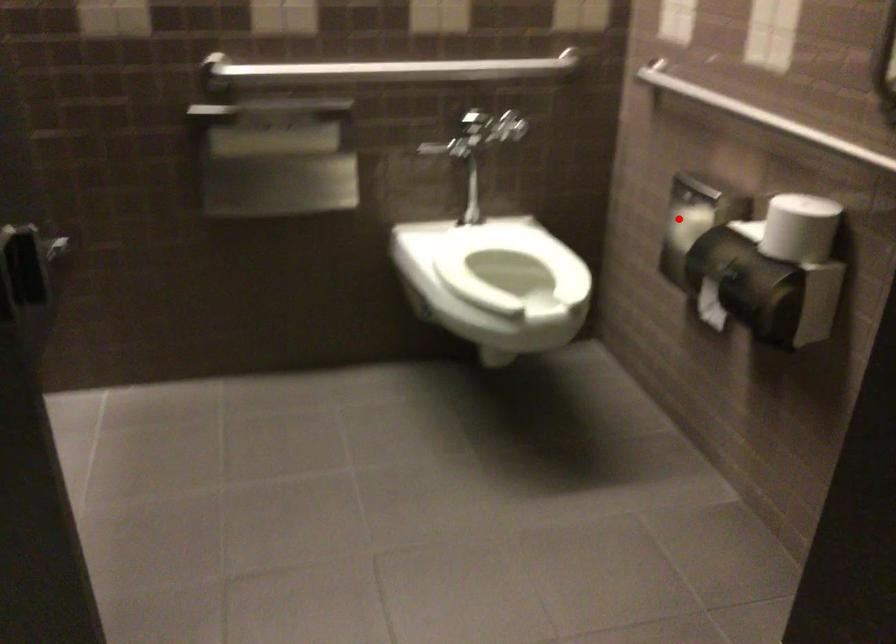
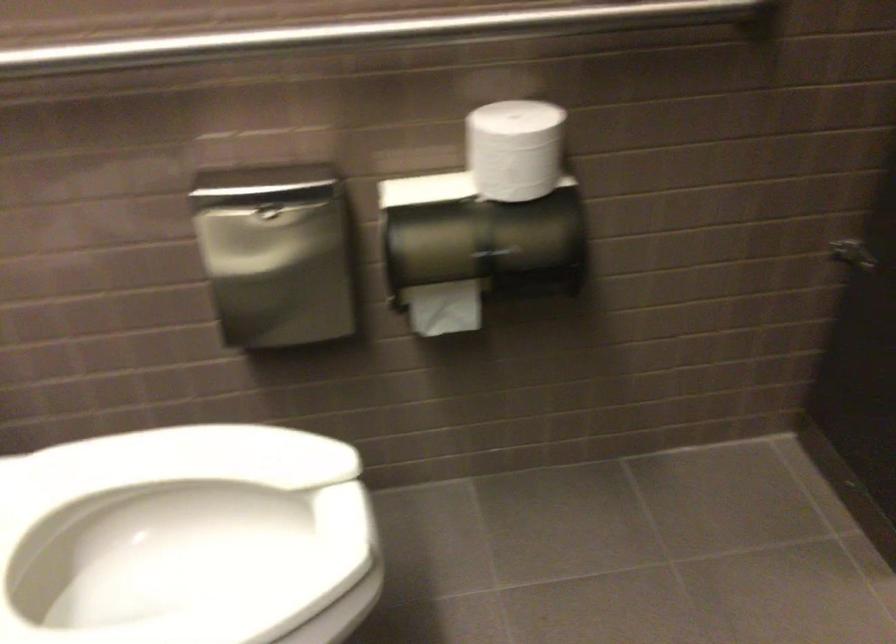
Find the pixel in the second image that matches the highlighted location in the first image.

(277, 252)